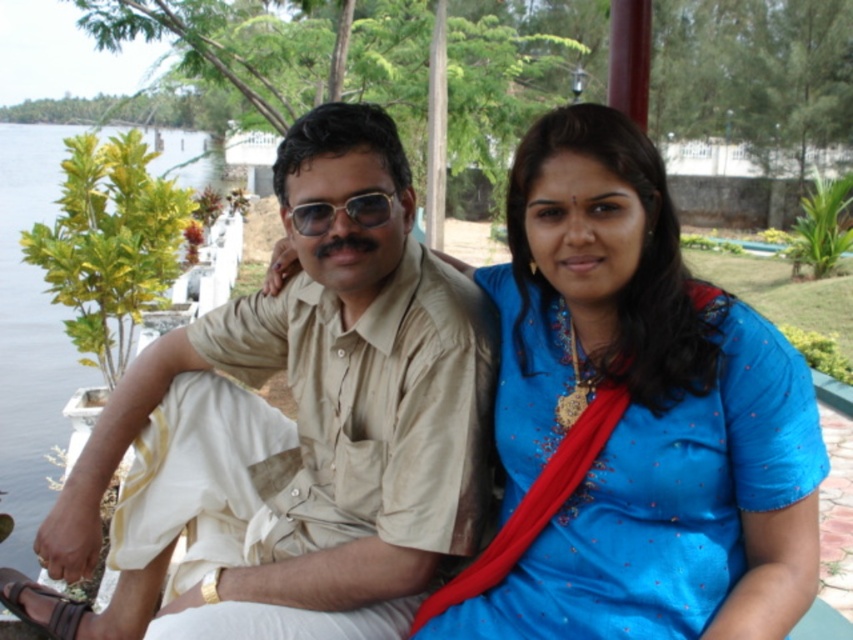
You are a photographer trying to capture the scene with the blue silk saree at center and the green leafy water at left. Which object should you focus on first if you want to emphasize the subject on the right side of your frame?

The blue silk saree at center should be focused on first since it is positioned on the right side of the green leafy water at left, making it the subject on the right in the frame.

You are a photographer trying to capture a clear shot of the blue silk saree at center and the matte plastic goggles at center. Since both are at the center, which one do you need to focus on first to ensure it appears sharp in the photo?

The blue silk saree at center is in front of matte plastic goggles at center, so you should focus on the blue silk saree at center first to ensure it appears sharp.